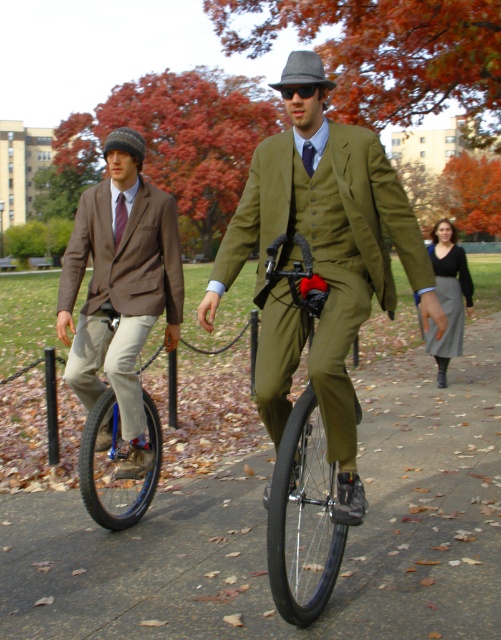
Looking at this image, you are a photographer planning to take a portrait of the two unicyclists. You want to ensure that both the matte brown blazer at left and the shiny black unicycle at left are clearly visible in the frame. Considering their sizes, which object should you focus on first to ensure proper focus and depth of field?

The matte brown blazer at left is smaller than the shiny black unicycle at left, so you should focus on the shiny black unicycle at left first to ensure both are in focus since it is larger and might require more precise focusing to capture details.

You are a photographer trying to capture the scene of two unicyclists. You notice the matte brown blazer at left and the shiny black unicycle at left. Which object is closer to the center of the image?

The matte brown blazer at left is positioned on the right side of the shiny black unicycle at left, so the shiny black unicycle at left is closer to the center of the image than the matte brown blazer at left.

You are standing at the center of the pathway and want to reach the shiny black unicycle at left. Which direction should you move to get there?

Since the shiny black unicycle at left is located at point 0.677 on the x axis and 0.234 on the y axis, you should move to the left and slightly forward to reach it.